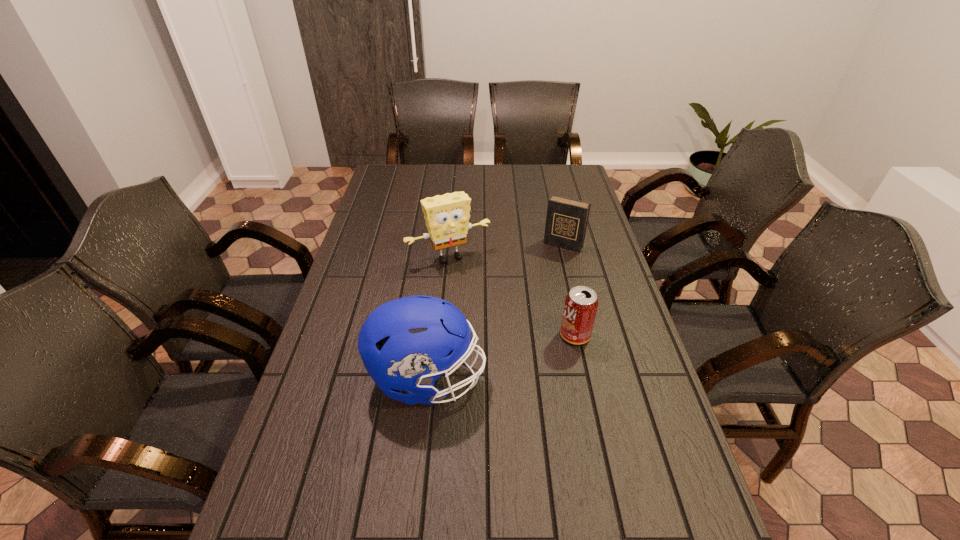
You are a GUI agent. You are given a task and a screenshot of the screen. Output one action in this format:
    pyautogui.click(x=<x>, y=<y>)
    Task: Click on the free space located 0.240m on the front cover of the diary
    The height and width of the screenshot is (540, 960).
    Given the screenshot: What is the action you would take?
    pyautogui.click(x=534, y=295)

You are a GUI agent. You are given a task and a screenshot of the screen. Output one action in this format:
    pyautogui.click(x=<x>, y=<y>)
    Task: Click on the vacant space located 0.240m on the front cover of the diary
    
    Given the screenshot: What is the action you would take?
    pyautogui.click(x=534, y=295)

At what (x,y) coordinates should I click in order to perform the action: click on object present at the left edge. Please return your answer as a coordinate pair (x, y). The width and height of the screenshot is (960, 540). Looking at the image, I should click on (406, 344).

This screenshot has height=540, width=960. Find the location of `soda can that is at the right edge`. soda can that is at the right edge is located at coordinates (580, 307).

The image size is (960, 540). Find the location of `diary that is positioned at the right edge`. diary that is positioned at the right edge is located at coordinates (566, 222).

Where is `vacant space at the far edge of the desktop`? The image size is (960, 540). vacant space at the far edge of the desktop is located at coordinates (468, 174).

Where is `vacant space at the near edge`? vacant space at the near edge is located at coordinates click(x=361, y=534).

This screenshot has height=540, width=960. In order to click on vacant space at the left edge of the desktop in this screenshot , I will do `click(394, 215)`.

Identify the location of blank space at the right edge of the desktop. This screenshot has height=540, width=960. (636, 338).

This screenshot has height=540, width=960. In the image, there is a desktop. In order to click on vacant space at the far left corner in this screenshot , I will do pos(379,183).